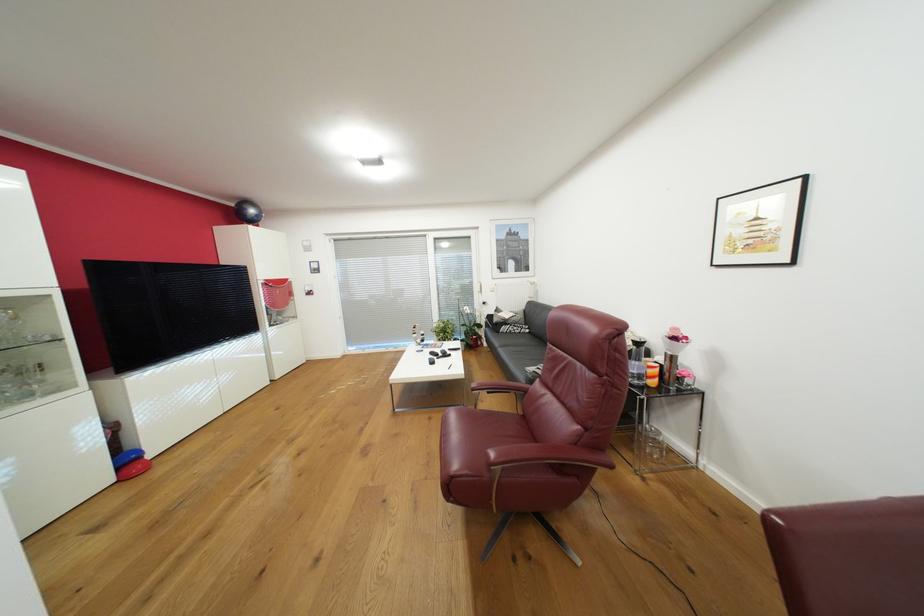
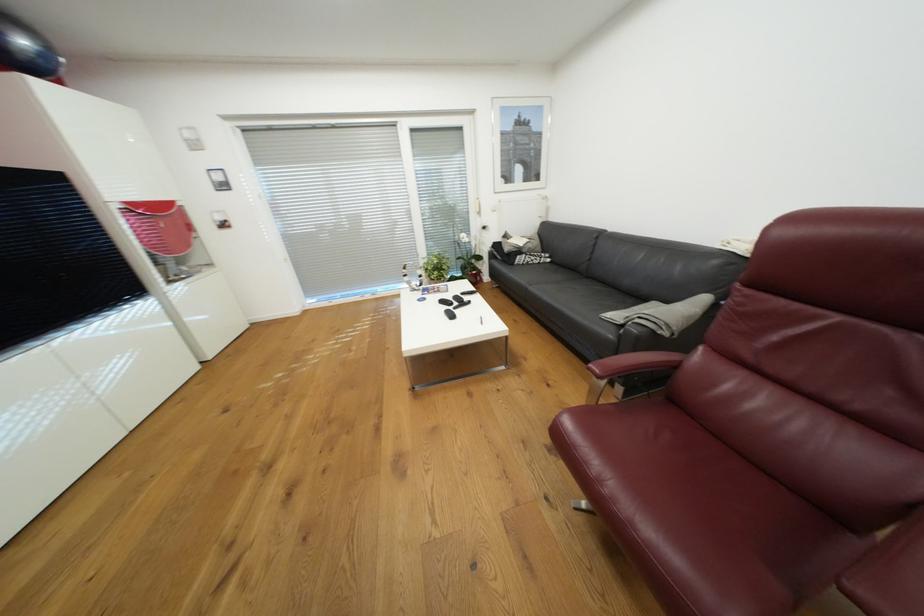
Find the pixel in the second image that matches pixel 512 322 in the first image.

(526, 252)